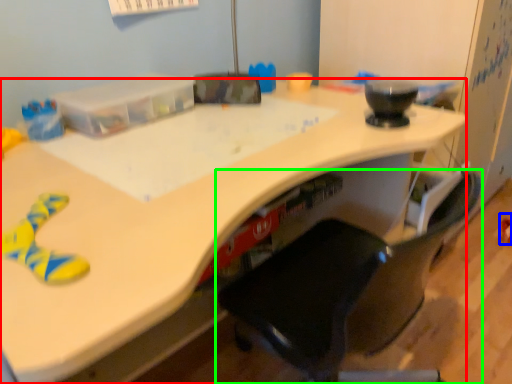
Question: Based on their relative distances, which object is farther from desk (highlighted by a red box)? Choose from toy (highlighted by a blue box) and chair (highlighted by a green box).

Choices:
 (A) toy
 (B) chair

Answer: (A)